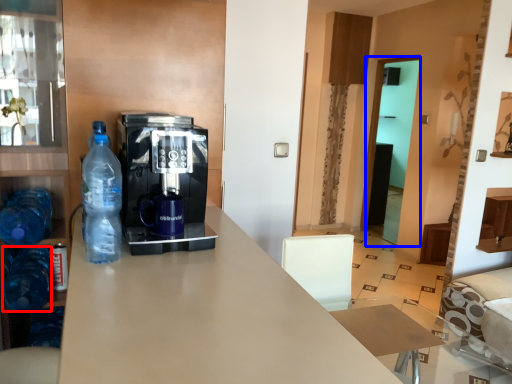
Question: Which object is closer to the camera taking this photo, bottle (highlighted by a red box) or glass door (highlighted by a blue box)?

Choices:
 (A) bottle
 (B) glass door

Answer: (A)